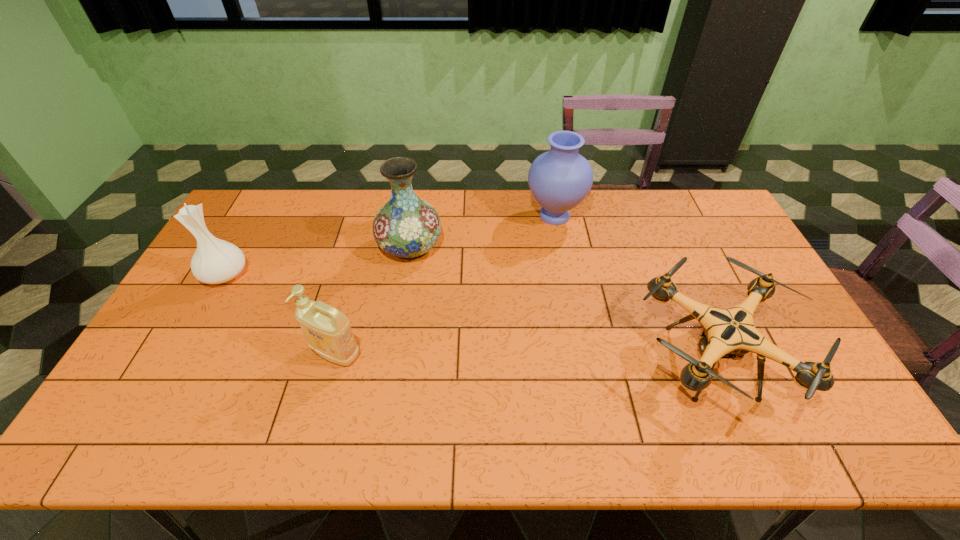
Where is `unoccupied area between the second vase from left to right and the drone`? The height and width of the screenshot is (540, 960). unoccupied area between the second vase from left to right and the drone is located at coordinates (560, 305).

The width and height of the screenshot is (960, 540). I want to click on empty space between the second object from right to left and the detergent, so coord(445,285).

Identify which object is located as the third nearest to the shortest object. Please provide its 2D coordinates. Your answer should be formatted as a tuple, i.e. [(x, y)], where the tuple contains the x and y coordinates of a point satisfying the conditions above.

[(328, 332)]

Select which object appears as the third closest to the shortest object. Please provide its 2D coordinates. Your answer should be formatted as a tuple, i.e. [(x, y)], where the tuple contains the x and y coordinates of a point satisfying the conditions above.

[(328, 332)]

Choose which vase is the nearest neighbor to the second object from right to left. Please provide its 2D coordinates. Your answer should be formatted as a tuple, i.e. [(x, y)], where the tuple contains the x and y coordinates of a point satisfying the conditions above.

[(407, 227)]

Find the location of a particular element. The width and height of the screenshot is (960, 540). the closest vase to the rightmost vase is located at coordinates (407, 227).

Where is `blank area in the image that satisfies the following two spatial constraints: 1. on the back side of the rightmost vase; 2. on the right side of the shortest vase`? The width and height of the screenshot is (960, 540). blank area in the image that satisfies the following two spatial constraints: 1. on the back side of the rightmost vase; 2. on the right side of the shortest vase is located at coordinates (257, 216).

Where is `vacant space that satisfies the following two spatial constraints: 1. on the back side of the rightmost vase; 2. on the left side of the leftmost vase`? vacant space that satisfies the following two spatial constraints: 1. on the back side of the rightmost vase; 2. on the left side of the leftmost vase is located at coordinates (257, 216).